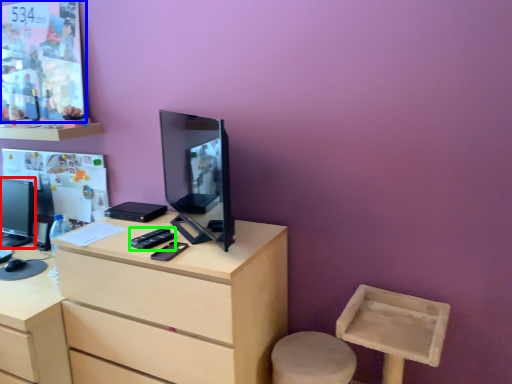
Question: Considering the real-world distances, which object is farthest from television (highlighted by a red box)? poster page (highlighted by a blue box) or remote control (highlighted by a green box)?

Choices:
 (A) poster page
 (B) remote control

Answer: (B)